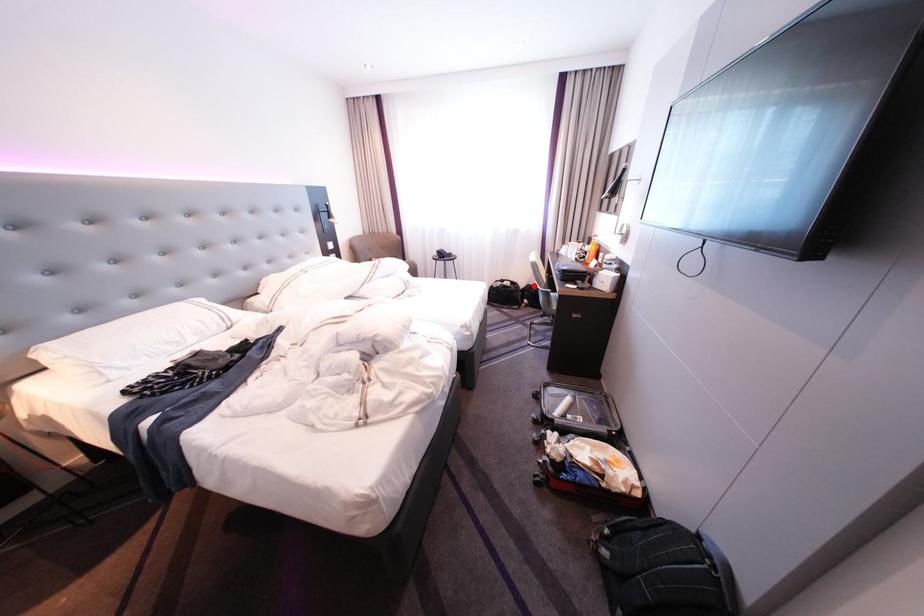
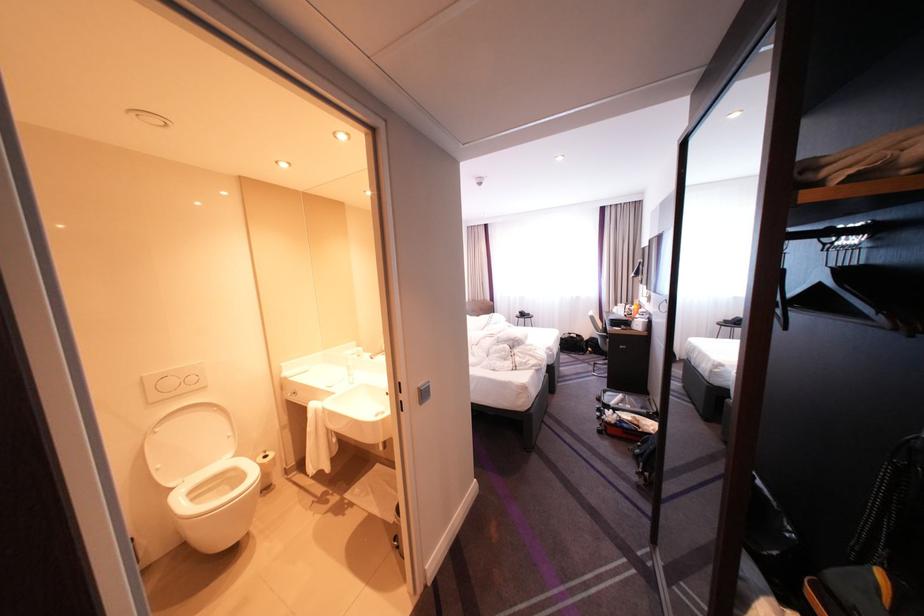
Question: I am providing you with two images of the same scene from different viewpoints. Image1 has a red point marked. In image2, the corresponding 3D location appears at what relative position? Reply with the corresponding letter.

Choices:
 (A) Closer
 (B) Farther

Answer: (B)